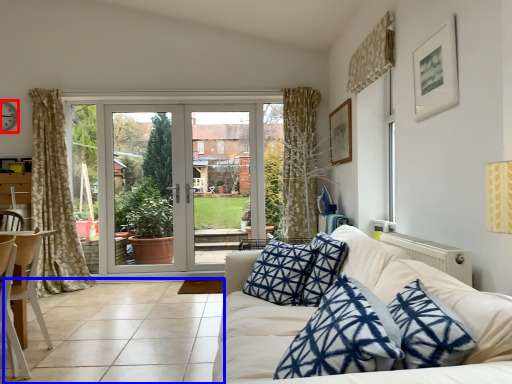
Question: Among these objects, which one is farthest to the camera, clock (highlighted by a red box) or tile (highlighted by a blue box)?

Choices:
 (A) clock
 (B) tile

Answer: (A)